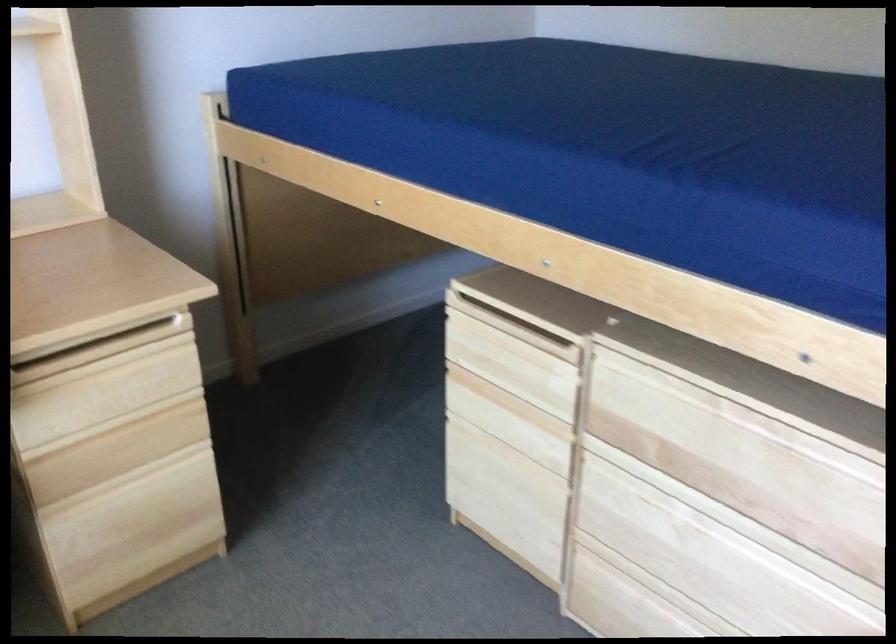
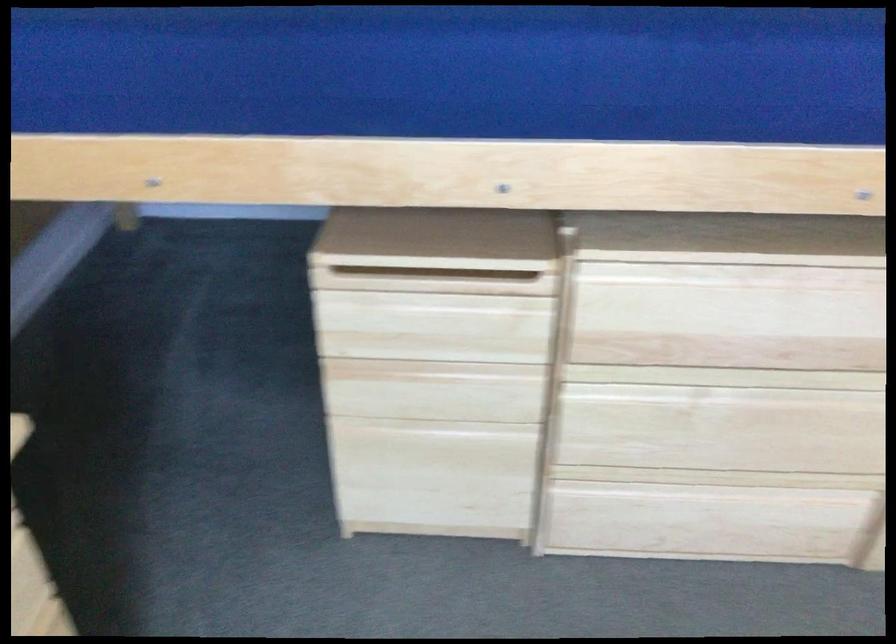
Where in the second image is the point corresponding to the point at 498,395 from the first image?

(426, 371)